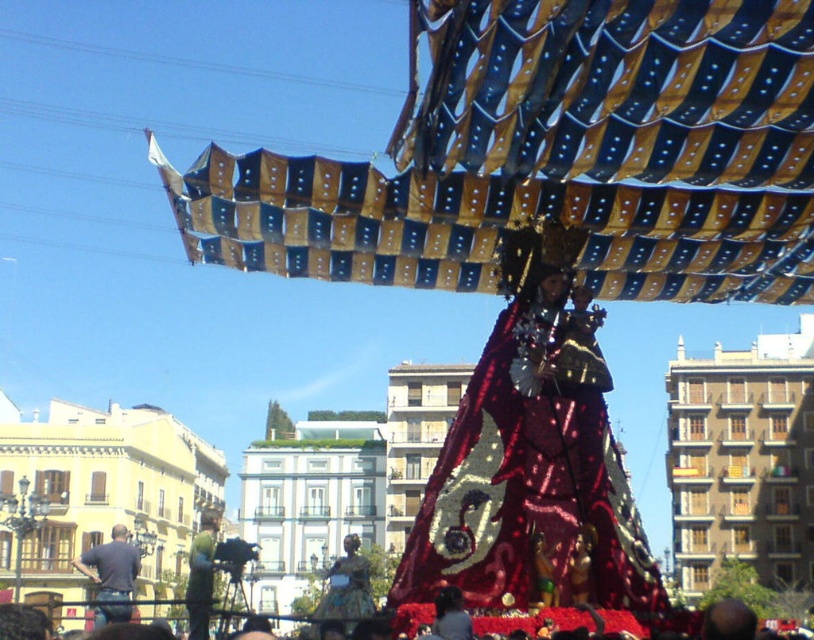
Is dark blue jeans at lower left positioned in front of matte gold fabric at center?

No, it is behind matte gold fabric at center.

What are the coordinates of `dark blue jeans at lower left` in the screenshot? It's located at (112, 576).

The image size is (814, 640). I want to click on dark blue jeans at lower left, so click(112, 576).

Is matte gold fabric at center smaller than green fabric costume at center?

Correct, matte gold fabric at center occupies less space than green fabric costume at center.

Which of these two, matte gold fabric at center or green fabric costume at center, stands taller?

Standing taller between the two is matte gold fabric at center.

This screenshot has width=814, height=640. Find the location of `matte gold fabric at center`. matte gold fabric at center is located at coordinates (348, 588).

Between point (528, 456) and point (88, 570), which one is positioned in front?

Point (528, 456)

Identify the location of shiny red fabric at center. Image resolution: width=814 pixels, height=640 pixels. (528, 497).